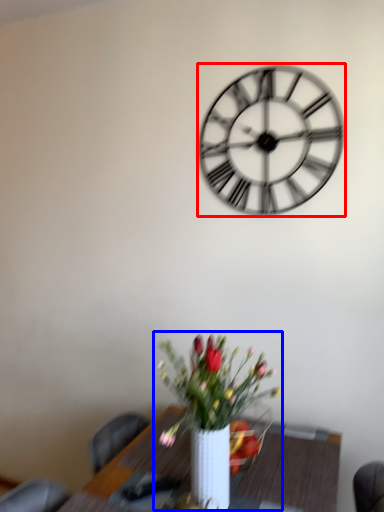
Question: Which of the following is the closest to the observer, wall clock (highlighted by a red box) or houseplant (highlighted by a blue box)?

Choices:
 (A) wall clock
 (B) houseplant

Answer: (B)